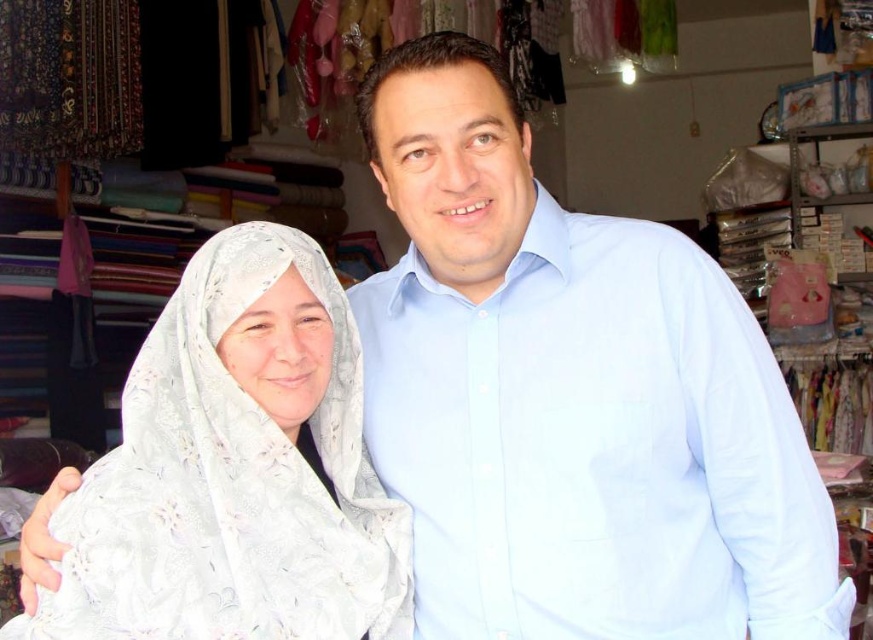
You are a customer in the shop and want to know if the light blue cotton shirt at center is positioned higher than the white lace headscarf at left. Can you confirm this?

The light blue cotton shirt at center is above the white lace headscarf at left, so yes, it is positioned higher.

You are a tailor trying to determine which garment has a greater width to use for a project. You see the light blue cotton shirt at center and the white lace headscarf at left. Which one has a larger width?

The light blue cotton shirt at center has a larger width than the white lace headscarf at left according to the description.

You are a customer in the store and want to buy both the light blue cotton shirt at center and the white lace headscarf at left. You need to place them on the fitting room table. Which item should you place first if you want to place the item on the left side of the table?

You should place the white lace headscarf at left first because the light blue cotton shirt at center is on the right side of the white lace headscarf at left, so to have the headscarf on the left side of the table, you should place it first.